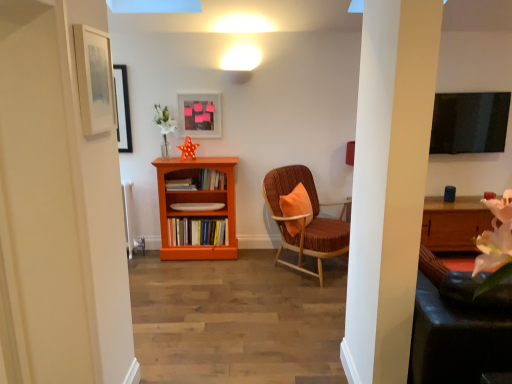
At what (x,y) coordinates should I click in order to perform the action: click on blank space situated above wooden bookshelf at center, the third book in the bottom-to-top sequence (from a real-world perspective). Please return your answer as a coordinate pair (x, y). The image size is (512, 384). Looking at the image, I should click on tap(211, 172).